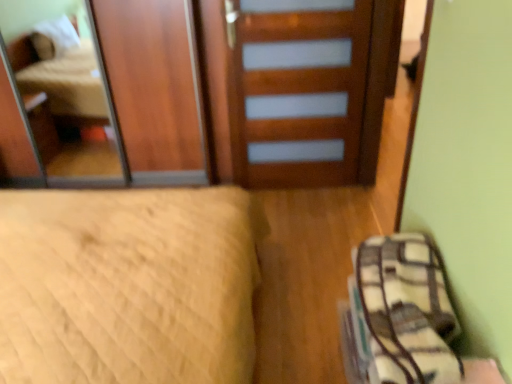
Question: Is beige quilted bed at lower left shorter than wooden door at center?

Choices:
 (A) no
 (B) yes

Answer: (B)

Question: From a real-world perspective, is beige quilted bed at lower left on wooden door at center?

Choices:
 (A) yes
 (B) no

Answer: (B)

Question: Is beige quilted bed at lower left thinner than wooden door at center?

Choices:
 (A) yes
 (B) no

Answer: (B)

Question: Is the position of beige quilted bed at lower left less distant than that of wooden door at center?

Choices:
 (A) yes
 (B) no

Answer: (A)

Question: Considering the relative sizes of beige quilted bed at lower left and wooden door at center in the image provided, is beige quilted bed at lower left wider than wooden door at center?

Choices:
 (A) no
 (B) yes

Answer: (B)

Question: Does beige quilted bed at lower left touch wooden door at center?

Choices:
 (A) no
 (B) yes

Answer: (A)

Question: Considering the relative positions of plaid fabric bag at lower right and wooden door at center in the image provided, is plaid fabric bag at lower right to the left of wooden door at center from the viewer's perspective?

Choices:
 (A) no
 (B) yes

Answer: (A)

Question: Is plaid fabric bag at lower right further to camera compared to wooden door at center?

Choices:
 (A) yes
 (B) no

Answer: (B)

Question: Does plaid fabric bag at lower right touch wooden door at center?

Choices:
 (A) yes
 (B) no

Answer: (B)

Question: From the image's perspective, is plaid fabric bag at lower right located above wooden door at center?

Choices:
 (A) yes
 (B) no

Answer: (B)

Question: From a real-world perspective, is plaid fabric bag at lower right located beneath wooden door at center?

Choices:
 (A) no
 (B) yes

Answer: (B)

Question: Could you tell me if plaid fabric bag at lower right is turned towards wooden door at center?

Choices:
 (A) no
 (B) yes

Answer: (A)

Question: Is wooden door at center to the left of plaid fabric bag at lower right from the viewer's perspective?

Choices:
 (A) yes
 (B) no

Answer: (A)